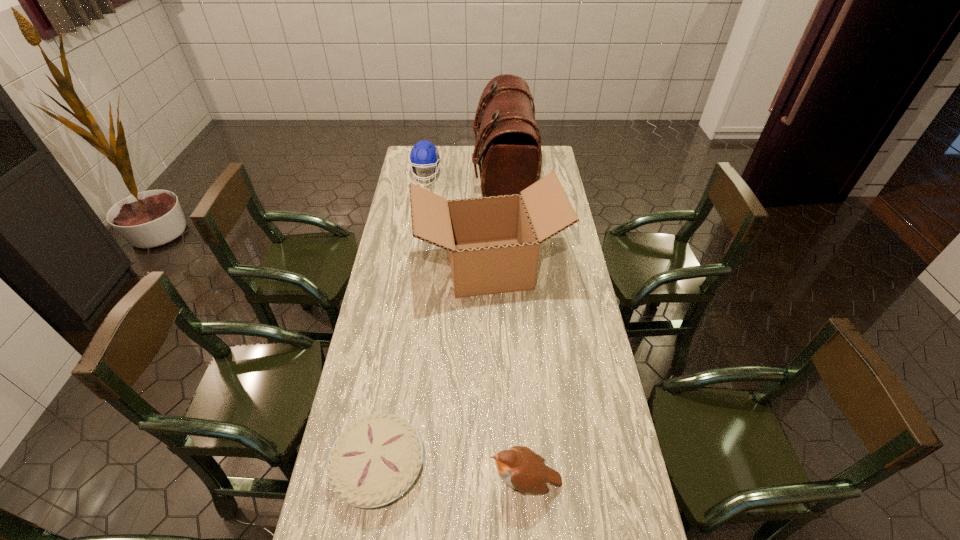
Locate an element on the screen. This screenshot has height=540, width=960. free region located 0.120m on the front-facing side of the football helmet is located at coordinates (422, 202).

Locate an element on the screen. This screenshot has width=960, height=540. vacant space located at the face of the bird is located at coordinates tap(369, 482).

What are the coordinates of `free region located at the face of the bird` in the screenshot? It's located at (376, 482).

At what (x,y) coordinates should I click in order to perform the action: click on vacant area situated 0.050m at the face of the bird. Please return your answer as a coordinate pair (x, y). This screenshot has height=540, width=960. Looking at the image, I should click on (470, 482).

Locate an element on the screen. The image size is (960, 540). free space located 0.090m on the back of the pie is located at coordinates (390, 395).

Identify the location of satchel that is at the far edge. (507, 148).

You are a GUI agent. You are given a task and a screenshot of the screen. Output one action in this format:
    pyautogui.click(x=<x>, y=<y>)
    Task: Click on the football helmet present at the far edge
    The height and width of the screenshot is (540, 960).
    Given the screenshot: What is the action you would take?
    pyautogui.click(x=423, y=154)

The height and width of the screenshot is (540, 960). Identify the location of box situated at the left edge. (493, 242).

I want to click on football helmet that is at the left edge, so click(x=423, y=154).

Where is `pie located in the left edge section of the desktop`? pie located in the left edge section of the desktop is located at coordinates (375, 460).